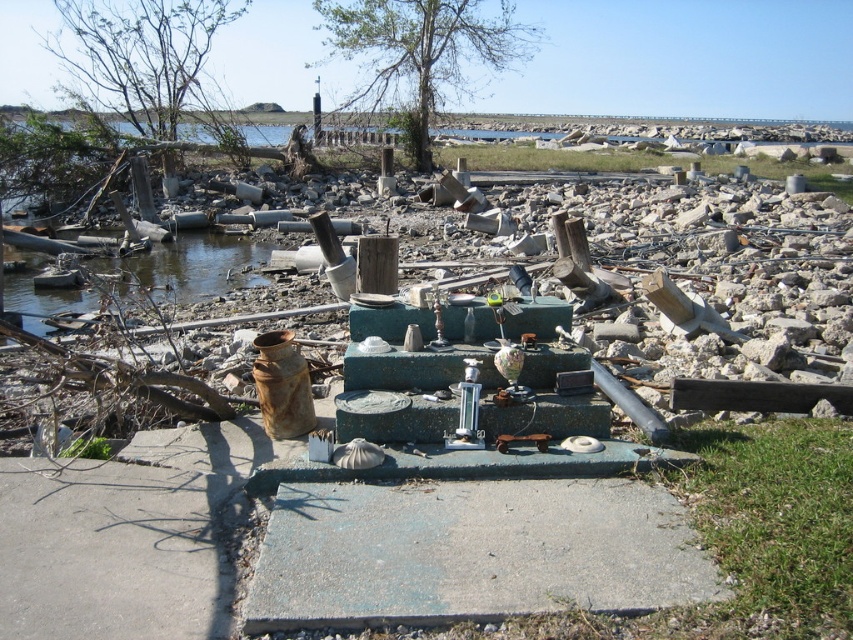
Question: Which point is closer to the camera taking this photo?

Choices:
 (A) (408, 522)
 (B) (222, 236)

Answer: (A)

Question: Which of the following is the closest to the observer?

Choices:
 (A) (219, 276)
 (B) (679, 522)

Answer: (B)

Question: Does gray concrete slab at center appear over clear water at left?

Choices:
 (A) yes
 (B) no

Answer: (B)

Question: Can you confirm if gray concrete slab at center is positioned above clear water at left?

Choices:
 (A) yes
 (B) no

Answer: (B)

Question: Which of the following is the farthest from the observer?

Choices:
 (A) (61, 298)
 (B) (463, 554)

Answer: (A)

Question: Is gray concrete slab at center to the right of clear water at left from the viewer's perspective?

Choices:
 (A) yes
 (B) no

Answer: (A)